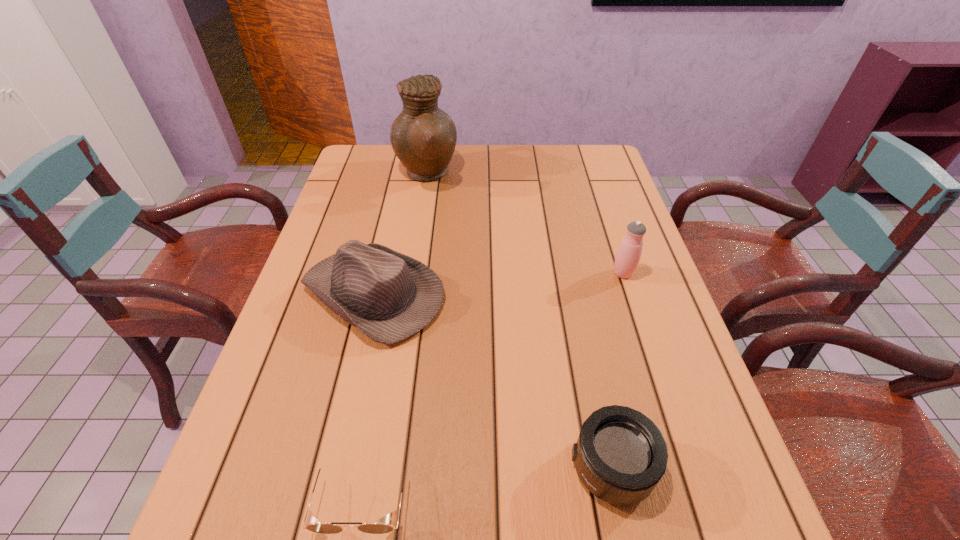
This screenshot has height=540, width=960. I want to click on unoccupied area between the second shortest object and the third tallest object, so click(492, 380).

You are a GUI agent. You are given a task and a screenshot of the screen. Output one action in this format:
    pyautogui.click(x=<x>, y=<y>)
    Task: Click on the vacant point located between the fourth tallest object and the third tallest object
    
    Given the screenshot: What is the action you would take?
    pyautogui.click(x=492, y=380)

Find the location of a particular element. free space between the fourth shortest object and the fourth object from left to right is located at coordinates (617, 370).

You are a GUI agent. You are given a task and a screenshot of the screen. Output one action in this format:
    pyautogui.click(x=<x>, y=<y>)
    Task: Click on the free point between the thermos bottle and the fedora
    
    Given the screenshot: What is the action you would take?
    pyautogui.click(x=498, y=284)

Locate an element on the screen. This screenshot has width=960, height=540. vacant space in between the farthest object and the second object from right to left is located at coordinates (519, 321).

You are a GUI agent. You are given a task and a screenshot of the screen. Output one action in this format:
    pyautogui.click(x=<x>, y=<y>)
    Task: Click on the second closest object to the pitcher
    
    Given the screenshot: What is the action you would take?
    [x=628, y=255]

You are a GUI agent. You are given a task and a screenshot of the screen. Output one action in this format:
    pyautogui.click(x=<x>, y=<y>)
    Task: Click on the object that is the closest one to the fedora
    The width and height of the screenshot is (960, 540).
    Given the screenshot: What is the action you would take?
    pyautogui.click(x=423, y=137)

You are a GUI agent. You are given a task and a screenshot of the screen. Output one action in this format:
    pyautogui.click(x=<x>, y=<y>)
    Task: Click on the vacant area in the image that satisfies the following two spatial constraints: 1. at the spout of the farthest object; 2. on the left side of the fourth shortest object
    
    Given the screenshot: What is the action you would take?
    point(411,273)

Locate an element on the screen. Image resolution: width=960 pixels, height=540 pixels. blank space that satisfies the following two spatial constraints: 1. at the spout of the pitcher; 2. on the front lenses of the shortest object is located at coordinates 375,496.

At what (x,y) coordinates should I click in order to perform the action: click on free location that satisfies the following two spatial constraints: 1. on the side of the second shortest object with brand markings and control switches; 2. on the front lenses of the shortest object. Please return your answer as a coordinate pair (x, y). This screenshot has height=540, width=960. Looking at the image, I should click on (617, 496).